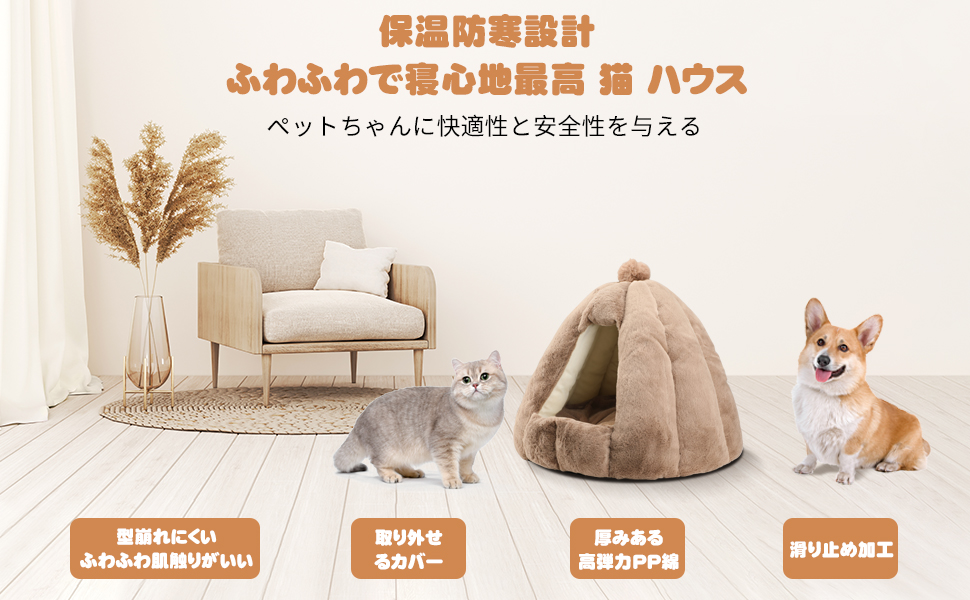
At what (x,y) coordinates should I click in order to perform the action: click on chair leg. Please return your answer as a coordinate pair (x, y). Looking at the image, I should click on (215, 372), (265, 377), (348, 363), (416, 367).